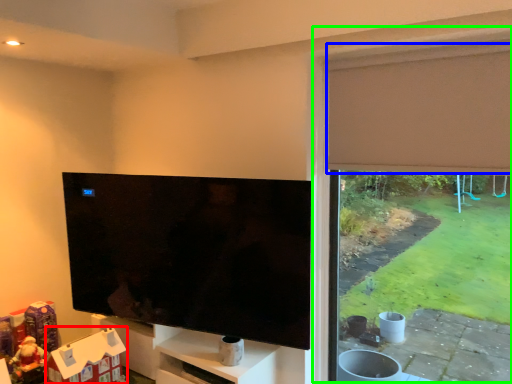
Question: Which object is positioned farthest from toy (highlighted by a red box)? Select from curtain (highlighted by a blue box) and window frame (highlighted by a green box).

Choices:
 (A) curtain
 (B) window frame

Answer: (A)